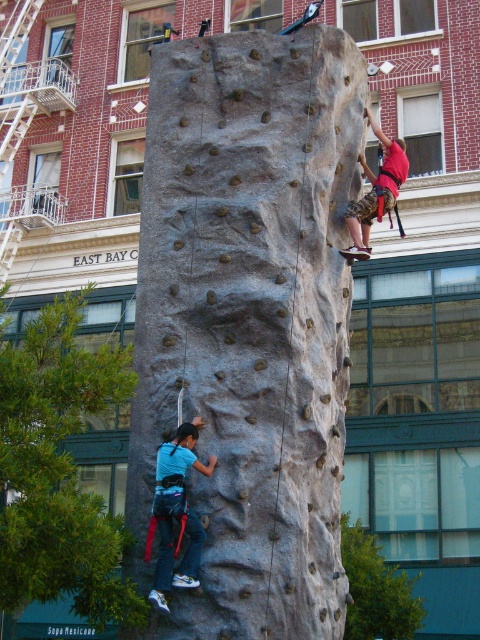
Question: Which object is farther from the camera taking this photo?

Choices:
 (A) blue fabric climbing harness at lower left
 (B) red fabric harness at upper right
 (C) smooth gray rock climbing at center

Answer: (B)

Question: Is blue fabric climbing harness at lower left further to camera compared to red fabric harness at upper right?

Choices:
 (A) no
 (B) yes

Answer: (A)

Question: Among these objects, which one is farthest from the camera?

Choices:
 (A) blue fabric climbing harness at lower left
 (B) red fabric harness at upper right
 (C) smooth gray rock climbing at center

Answer: (B)

Question: Estimate the real-world distances between objects in this image. Which object is farther from the smooth gray rock climbing at center?

Choices:
 (A) blue fabric climbing harness at lower left
 (B) red fabric harness at upper right

Answer: (B)

Question: Can you confirm if smooth gray rock climbing at center is smaller than red fabric harness at upper right?

Choices:
 (A) yes
 (B) no

Answer: (B)

Question: Can you confirm if smooth gray rock climbing at center is positioned above red fabric harness at upper right?

Choices:
 (A) no
 (B) yes

Answer: (A)